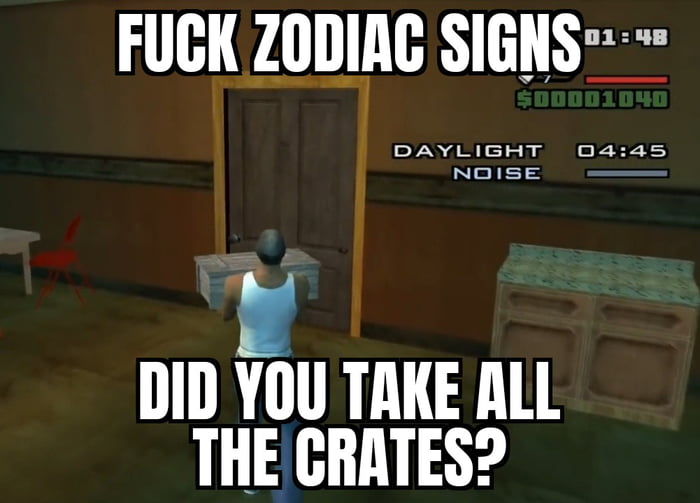
I want to click on table, so click(20, 238).